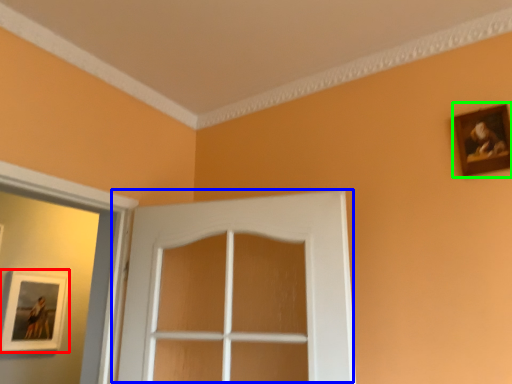
Question: Which is nearer to the picture frame (highlighted by a red box)? door (highlighted by a blue box) or picture frame (highlighted by a green box).

Choices:
 (A) door
 (B) picture frame

Answer: (A)